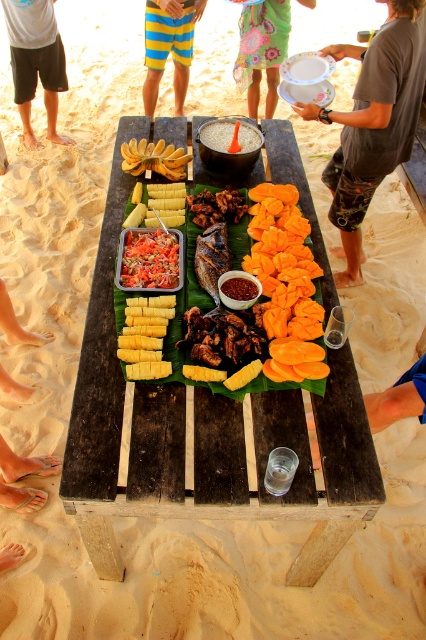
Question: Can you confirm if white glossy plate at center is positioned above white ceramic plate at center?

Choices:
 (A) yes
 (B) no

Answer: (A)

Question: Does yellow crispy chips at center appear on the left side of white rice at center?

Choices:
 (A) yes
 (B) no

Answer: (B)

Question: Which object is positioned closest to the red chili paste at center?

Choices:
 (A) yellow matte bananas at upper left
 (B) dark wood table at center

Answer: (B)

Question: Estimate the real-world distances between objects in this image. Which object is closer to the brown textured pants at lower right?

Choices:
 (A) yellow crispy chips at center
 (B) yellow matte pineapple at center

Answer: (A)

Question: Does bright orange shredded carrots at center appear under white glossy plate at center?

Choices:
 (A) yes
 (B) no

Answer: (A)

Question: Which object is the farthest from the yellow corn at center?

Choices:
 (A) yellow striped shorts at center
 (B) red chili paste at center
 (C) white ceramic plate at center
 (D) bright orange shredded carrots at center

Answer: (A)